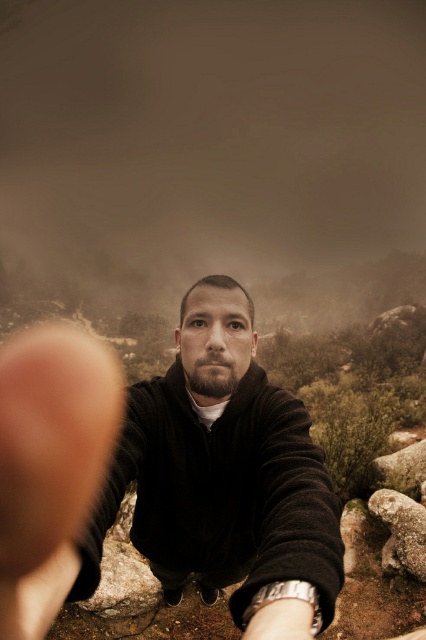
You are a photographer trying to capture the entire scene in one shot. Given that the black matte jacket at center and the rough textured rock at lower right are both in focus, which object would appear larger in the photo?

The black matte jacket at center would appear larger in the photo because it is bigger than the rough textured rock at lower right.

You are standing at point [317,481] and want to take a selfie using a camera that has a maximum focus range of 4 feet. Can you take a clear photo of yourself without moving the camera?

The distance between point [317,481] and the camera is 3.74 feet, which is within the camera maximum focus range of 4 feet. Therefore, you can take a clear photo of yourself without moving the camera.

You are a photographer trying to capture the rough textured rock at lower right clearly. However, the black matte jacket at center is blocking your view. Can you move the jacket to get a clear shot of the rock?

The black matte jacket at center is in front of the rough textured rock at lower right, so moving the jacket would allow you to see the rock clearly.